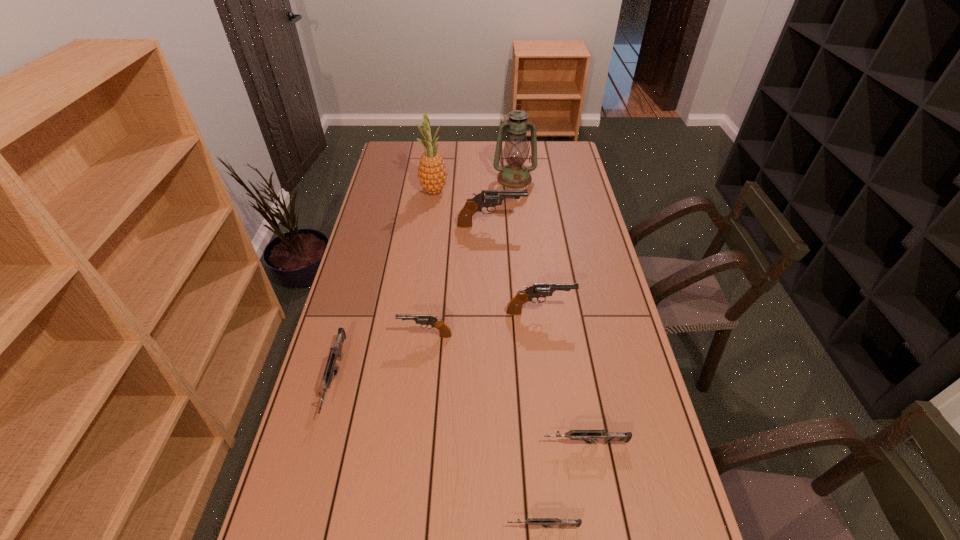
This screenshot has height=540, width=960. Find the location of `vacant space that's between the pineapple and the oil lamp`. vacant space that's between the pineapple and the oil lamp is located at coordinates (474, 185).

Locate an element on the screen. The height and width of the screenshot is (540, 960). the second closest object to the oil lamp is located at coordinates (491, 197).

Locate an element on the screen. object that is the fourth closest to the second nearest grey gun is located at coordinates (335, 353).

Select which gun appears as the fourth closest to the second tallest gun. Please provide its 2D coordinates. Your answer should be formatted as a tuple, i.e. [(x, y)], where the tuple contains the x and y coordinates of a point satisfying the conditions above.

[(335, 353)]

You are a GUI agent. You are given a task and a screenshot of the screen. Output one action in this format:
    pyautogui.click(x=<x>, y=<y>)
    Task: Click on the gun that stands as the fourth closest to the pineapple
    The width and height of the screenshot is (960, 540).
    Given the screenshot: What is the action you would take?
    pyautogui.click(x=335, y=353)

Identify the location of black gun object that ranks as the closest to the second biggest grey gun. The height and width of the screenshot is (540, 960). (445, 332).

Where is `black gun that is the third closest one to the oil lamp`? This screenshot has height=540, width=960. black gun that is the third closest one to the oil lamp is located at coordinates (445, 332).

Find the location of a particular element. The width and height of the screenshot is (960, 540). grey gun that is the third nearest to the fifth tallest object is located at coordinates (543, 522).

Where is `grey gun that is the closest to the shortest gun`? The width and height of the screenshot is (960, 540). grey gun that is the closest to the shortest gun is located at coordinates (592, 435).

Where is `vacant space that satisfies the following two spatial constraints: 1. along the barrel of the fifth shortest object; 2. aimed along the barrel of the leftmost object`? The height and width of the screenshot is (540, 960). vacant space that satisfies the following two spatial constraints: 1. along the barrel of the fifth shortest object; 2. aimed along the barrel of the leftmost object is located at coordinates (548, 377).